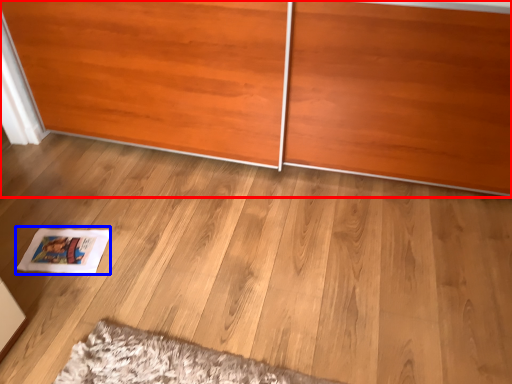
Question: Among these objects, which one is farthest to the camera, furniture (highlighted by a red box) or magazine (highlighted by a blue box)?

Choices:
 (A) furniture
 (B) magazine

Answer: (B)